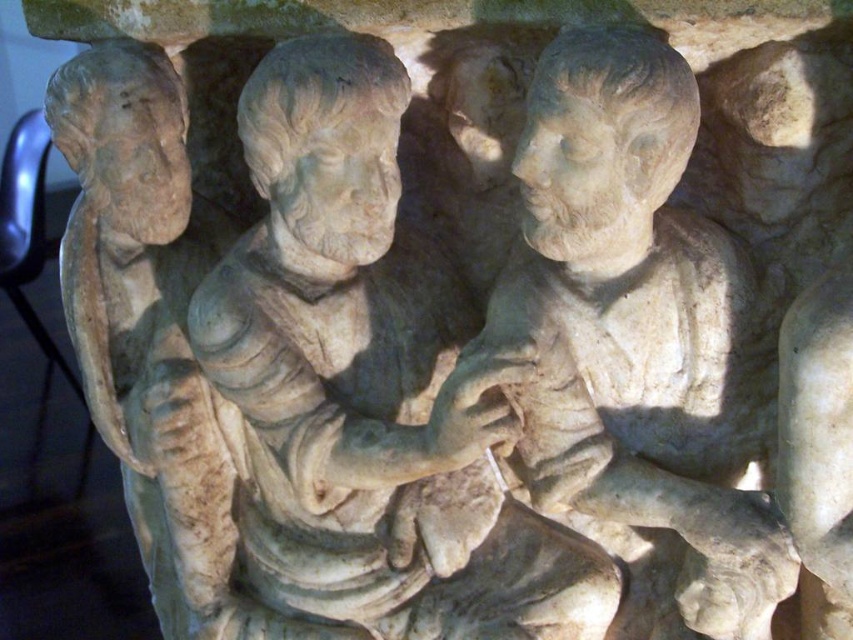
Is white marble statue at center below white stone statue at center?

Indeed, white marble statue at center is positioned under white stone statue at center.

Between white marble statue at center and white stone statue at center, which one appears on the left side from the viewer's perspective?

Positioned to the left is white marble statue at center.

What do you see at coordinates (370, 385) in the screenshot?
I see `white marble statue at center` at bounding box center [370, 385].

This screenshot has width=853, height=640. In order to click on white marble statue at center in this screenshot , I will do `click(370, 385)`.